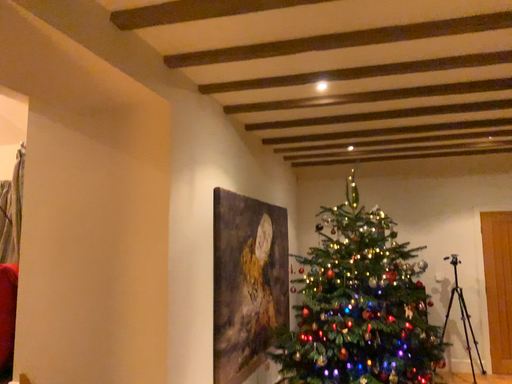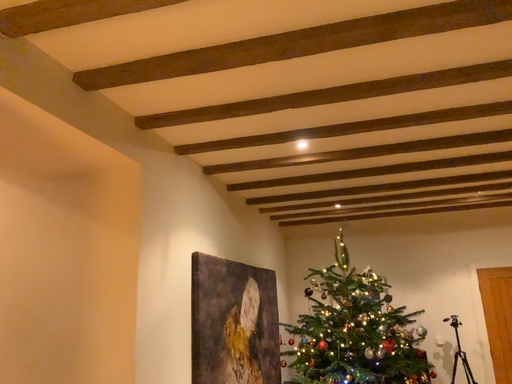
Question: Which way did the camera rotate in the video?

Choices:
 (A) rotated downward
 (B) rotated upward

Answer: (B)